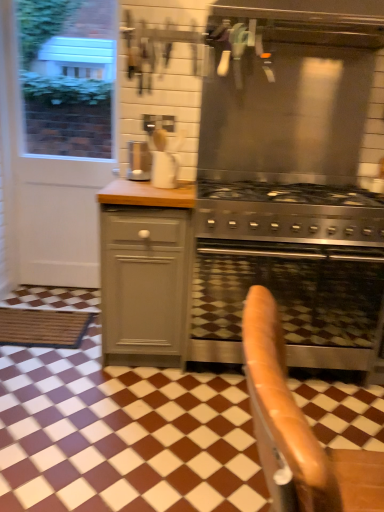
Where is `free space in front of matte gray cabinet at center-left`? The height and width of the screenshot is (512, 384). free space in front of matte gray cabinet at center-left is located at coordinates (134, 401).